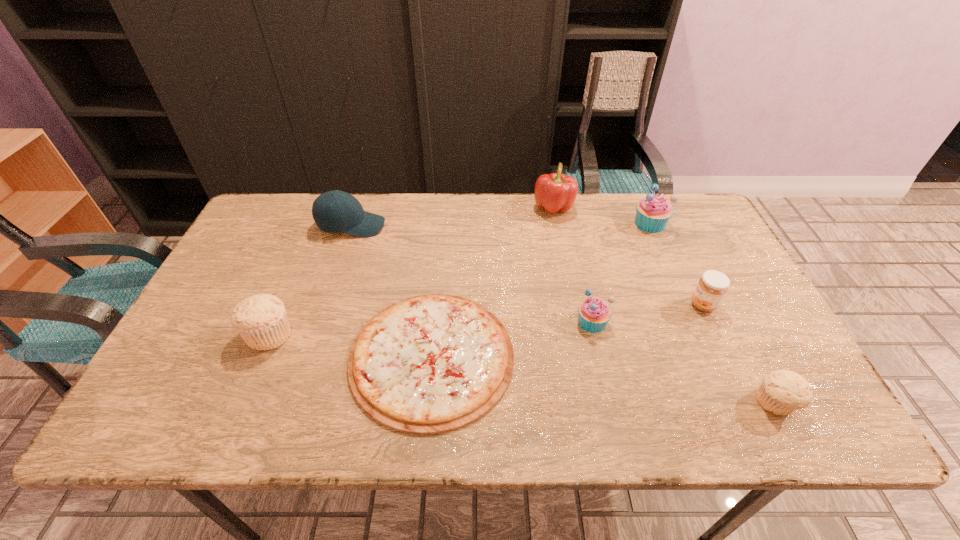
You are a GUI agent. You are given a task and a screenshot of the screen. Output one action in this format:
    pyautogui.click(x=<x>, y=<y>)
    Task: Click on the pepper
    
    Given the screenshot: What is the action you would take?
    pyautogui.click(x=556, y=192)

Identify the location of blue baseball cap. The image size is (960, 540). (335, 211).

The image size is (960, 540). In order to click on the bigger blue muffin in this screenshot , I will do `click(652, 213)`.

The width and height of the screenshot is (960, 540). I want to click on the farther blue muffin, so click(652, 213).

The image size is (960, 540). I want to click on the farther beige muffin, so click(261, 320).

This screenshot has width=960, height=540. In order to click on the bigger beige muffin in this screenshot , I will do coord(261,320).

I want to click on orange jam, so click(x=712, y=286).

In order to click on the smaller blue muffin in this screenshot , I will do `click(594, 313)`.

The image size is (960, 540). In order to click on the left blue muffin in this screenshot , I will do (594, 313).

The width and height of the screenshot is (960, 540). I want to click on the rightmost muffin, so click(x=781, y=392).